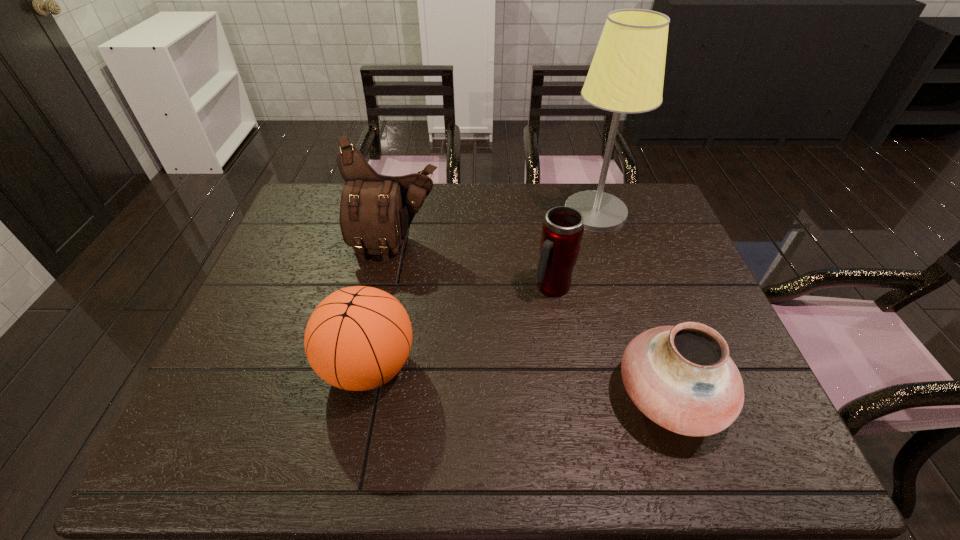
This screenshot has width=960, height=540. Identify the location of object that ranks as the second closest to the fourth shortest object. (562, 231).

Find the location of a particular element. This screenshot has width=960, height=540. vacant region that satisfies the following two spatial constraints: 1. on the front side of the pottery; 2. on the left side of the basketball is located at coordinates (363, 395).